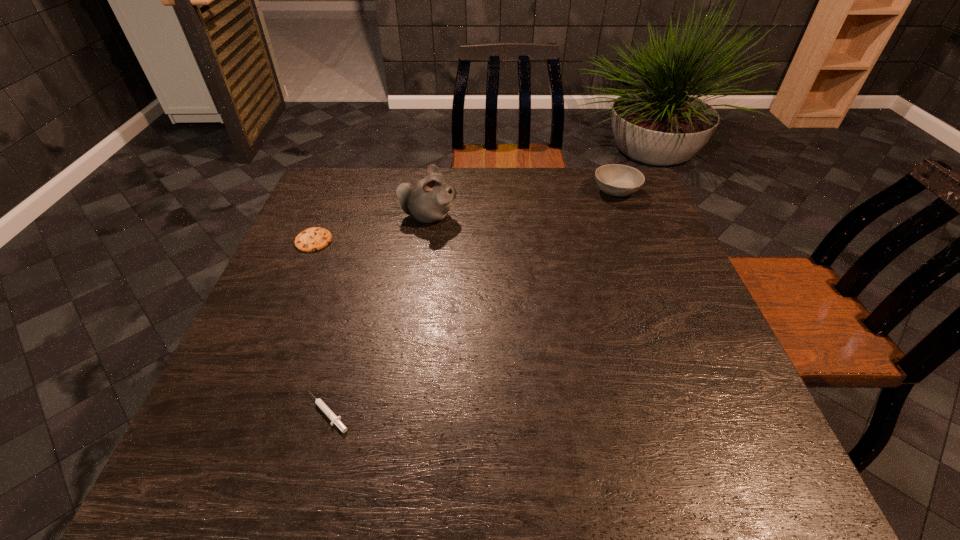
The width and height of the screenshot is (960, 540). Identify the location of vacant space positioned 0.180m on the front of the cookie. (287, 303).

Locate an element on the screen. The width and height of the screenshot is (960, 540). free point located on the back of the nearest object is located at coordinates (367, 267).

Locate an element on the screen. The height and width of the screenshot is (540, 960). hamster that is at the far edge is located at coordinates (428, 200).

The image size is (960, 540). In order to click on bowl that is at the far edge in this screenshot , I will do click(x=617, y=180).

The image size is (960, 540). Identify the location of object present at the left edge. (313, 239).

This screenshot has width=960, height=540. What are the coordinates of `object that is at the right edge` in the screenshot? It's located at (617, 180).

Where is `object present at the far right corner`? The height and width of the screenshot is (540, 960). object present at the far right corner is located at coordinates (617, 180).

You are a GUI agent. You are given a task and a screenshot of the screen. Output one action in this format:
    pyautogui.click(x=<x>, y=<y>)
    Task: Click on the vacant space at the far edge of the desktop
    
    Given the screenshot: What is the action you would take?
    pyautogui.click(x=550, y=207)

This screenshot has height=540, width=960. I want to click on free space at the near edge of the desktop, so click(x=629, y=439).

You are a GUI agent. You are given a task and a screenshot of the screen. Output one action in this format:
    pyautogui.click(x=<x>, y=<y>)
    Task: Click on the free space at the left edge of the desktop
    The image size is (960, 540).
    Given the screenshot: What is the action you would take?
    pyautogui.click(x=336, y=240)